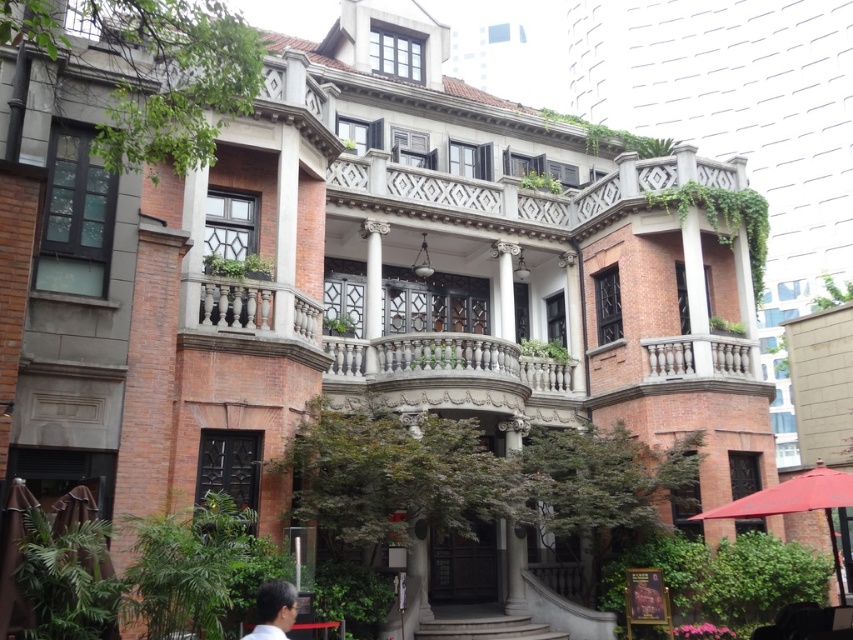
You are standing at the point labeled point (515, 541) and want to reach the entrance of the building. The entrance is located at the base of the building. Given that the distance between you and the entrance is 40.31 meters, can you estimate how many steps you would need to take if each step covers approximately 0.75 meters?

The distance between you and the entrance is 40.31 meters. If each step covers 0.75 meters, then dividing 40.31 by 0.75 gives approximately 53.75 steps. Since you can only take whole steps, you would need about 54 steps to reach the entrance.

You are standing in a park across from the building. You want to take a photo of the white marble column at center without any obstructions. Given that the nearest tree is 10 meters away from you, and the column is 38.67 meters away, can you walk closer to get a better shot without the tree blocking the column?

The white marble column at center is 38.67 meters away from you. Since the nearest tree is only 10 meters away, walking closer would bring the tree between you and the column, obstructing the view. Therefore, you should stay at least 38.67 meters away to keep the column visible without the tree blocking it.

You are an architect assessing the building facade. You notice the white marble column at center and the dark brown hair at lower center. Which object has a greater width?

The white marble column at center has a greater width than the dark brown hair at lower center.